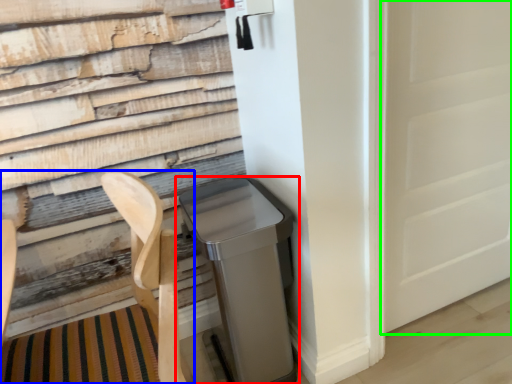
Question: Based on their relative distances, which object is nearer to waste container (highlighted by a red box)? Choose from folding chair (highlighted by a blue box) and screen door (highlighted by a green box).

Choices:
 (A) folding chair
 (B) screen door

Answer: (A)